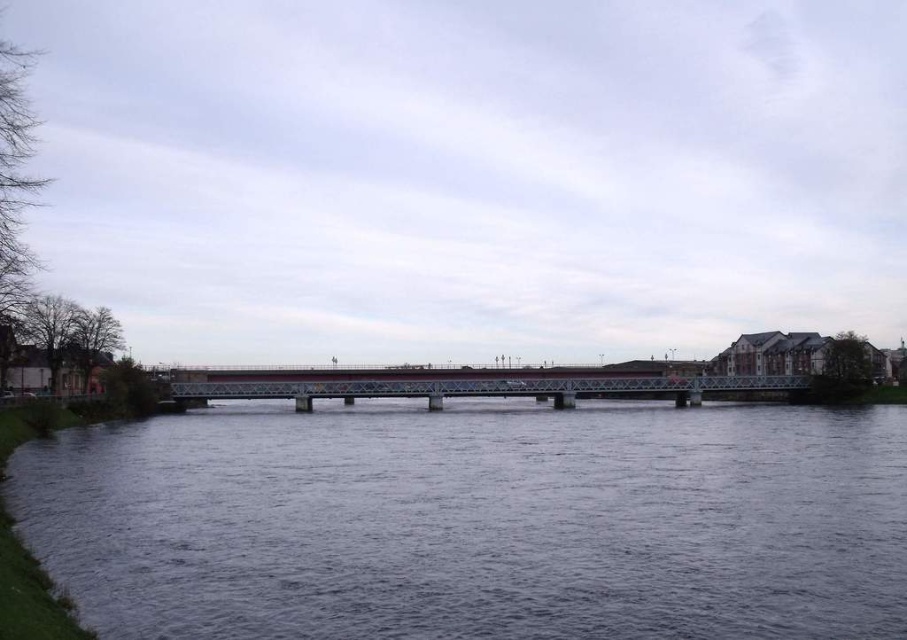
Question: Which object appears closest to the camera in this image?

Choices:
 (A) dark gray water at center
 (B) metallic bridge at center

Answer: (A)

Question: Can you confirm if dark gray water at center is positioned to the right of metallic bridge at center?

Choices:
 (A) yes
 (B) no

Answer: (A)

Question: Does dark gray water at center have a lesser width compared to metallic bridge at center?

Choices:
 (A) yes
 (B) no

Answer: (A)

Question: Does dark gray water at center have a lesser width compared to metallic bridge at center?

Choices:
 (A) no
 (B) yes

Answer: (B)

Question: Among these points, which one is nearest to the camera?

Choices:
 (A) (197, 380)
 (B) (272, 570)

Answer: (B)

Question: Which point is farther to the camera?

Choices:
 (A) metallic bridge at center
 (B) dark gray water at center

Answer: (A)